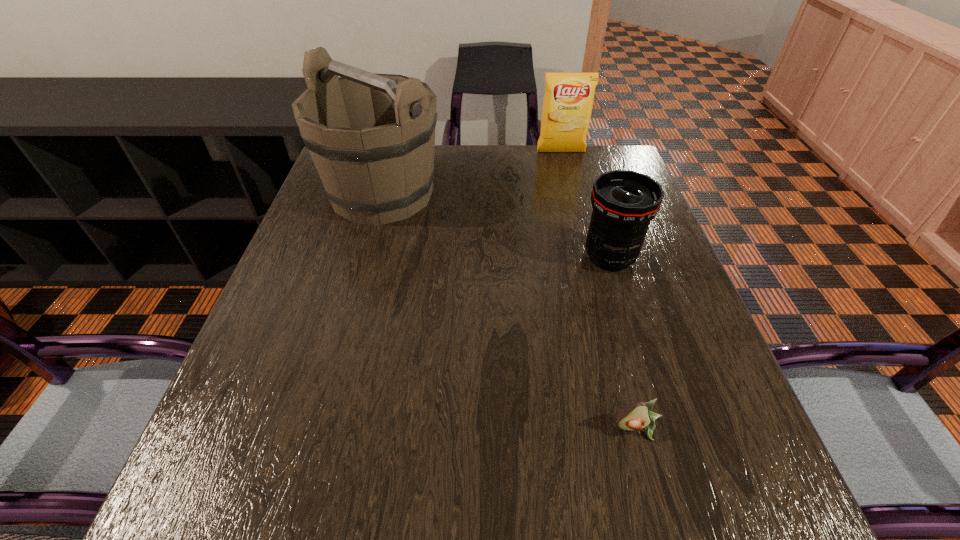
Find the location of a particular element. Image resolution: width=960 pixels, height=540 pixels. vacant region at the far edge of the desktop is located at coordinates (496, 166).

You are a GUI agent. You are given a task and a screenshot of the screen. Output one action in this format:
    pyautogui.click(x=<x>, y=<y>)
    Task: Click on the free space at the near edge of the desktop
    Image resolution: width=960 pixels, height=540 pixels.
    Given the screenshot: What is the action you would take?
    pyautogui.click(x=411, y=476)

At what (x,y) coordinates should I click in order to perform the action: click on free space at the left edge of the desktop. Please return your answer as a coordinate pair (x, y). This screenshot has width=960, height=540. Looking at the image, I should click on (322, 301).

The width and height of the screenshot is (960, 540). What are the coordinates of `vacant space at the right edge of the desktop` in the screenshot? It's located at (670, 278).

In the image, there is a desktop. Where is `free space at the near left corner`? free space at the near left corner is located at coordinates (221, 503).

Where is `free space at the far right corner of the desktop`? The width and height of the screenshot is (960, 540). free space at the far right corner of the desktop is located at coordinates (603, 147).

Image resolution: width=960 pixels, height=540 pixels. What are the coordinates of `vacant area between the crisp (potato chip) and the tallest object` in the screenshot? It's located at (471, 173).

Find the location of a particular element. This screenshot has height=540, width=960. unoccupied position between the second farthest object and the third shortest object is located at coordinates (471, 173).

Where is `free point between the farthest object and the telephoto lens`? Image resolution: width=960 pixels, height=540 pixels. free point between the farthest object and the telephoto lens is located at coordinates (586, 205).

The width and height of the screenshot is (960, 540). In order to click on free spot between the second farthest object and the shortest object in this screenshot , I will do `click(510, 311)`.